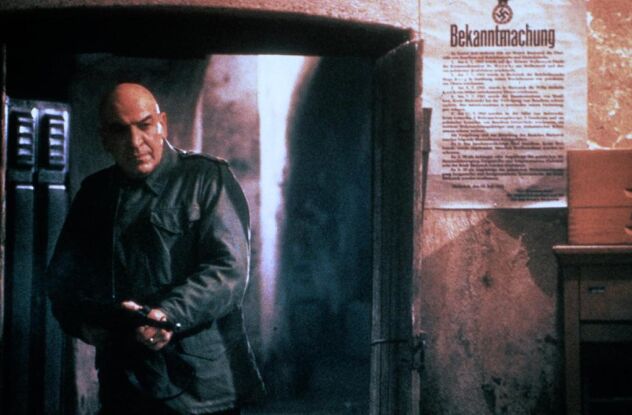
Identify the location of entrence. (x=260, y=180).